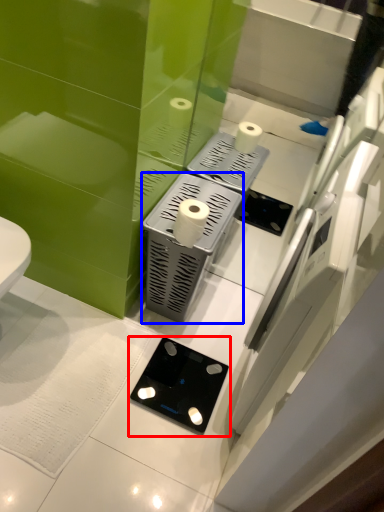
Question: Which object is further to the camera taking this photo, gadget (highlighted by a red box) or appliance (highlighted by a blue box)?

Choices:
 (A) gadget
 (B) appliance

Answer: (A)